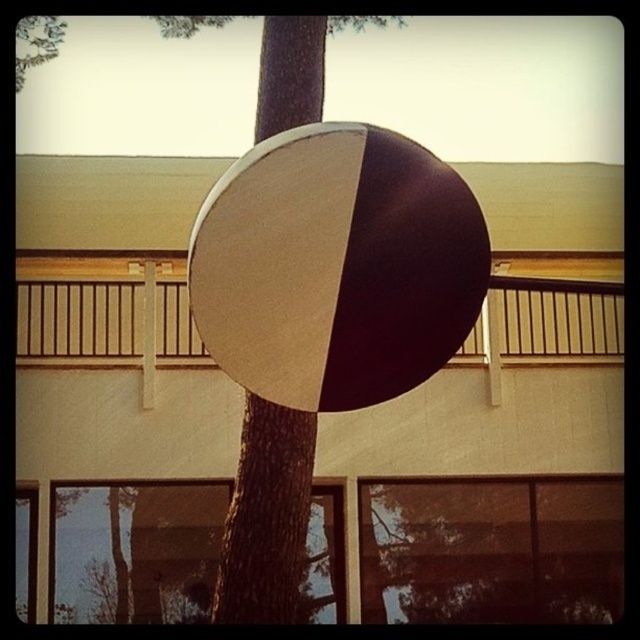
Question: Is brown textured tree trunk at center further to the viewer compared to wooden at center?

Choices:
 (A) no
 (B) yes

Answer: (B)

Question: Which of these objects is positioned farthest from the wooden at center?

Choices:
 (A) matte white and dark brown beach ball at center
 (B) brown textured tree trunk at center

Answer: (B)

Question: Which point appears farthest from the camera in this image?

Choices:
 (A) (49, 328)
 (B) (406, 244)

Answer: (A)

Question: Which point is closer to the camera taking this photo?

Choices:
 (A) (442, 182)
 (B) (566, 324)

Answer: (A)

Question: Is matte white and dark brown beach ball at center closer to camera compared to wooden at center?

Choices:
 (A) yes
 (B) no

Answer: (A)

Question: Can you confirm if brown textured tree trunk at center is thinner than wooden at center?

Choices:
 (A) yes
 (B) no

Answer: (A)